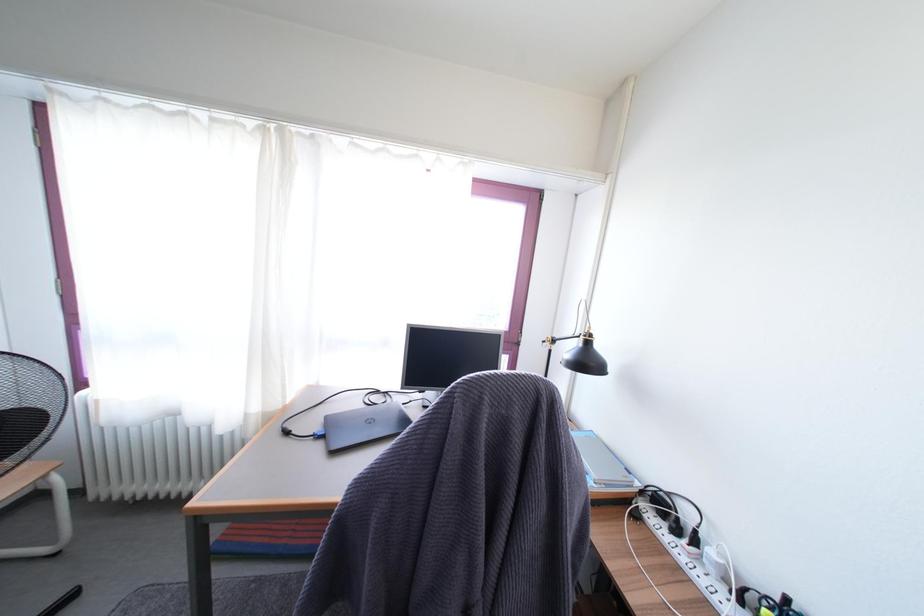
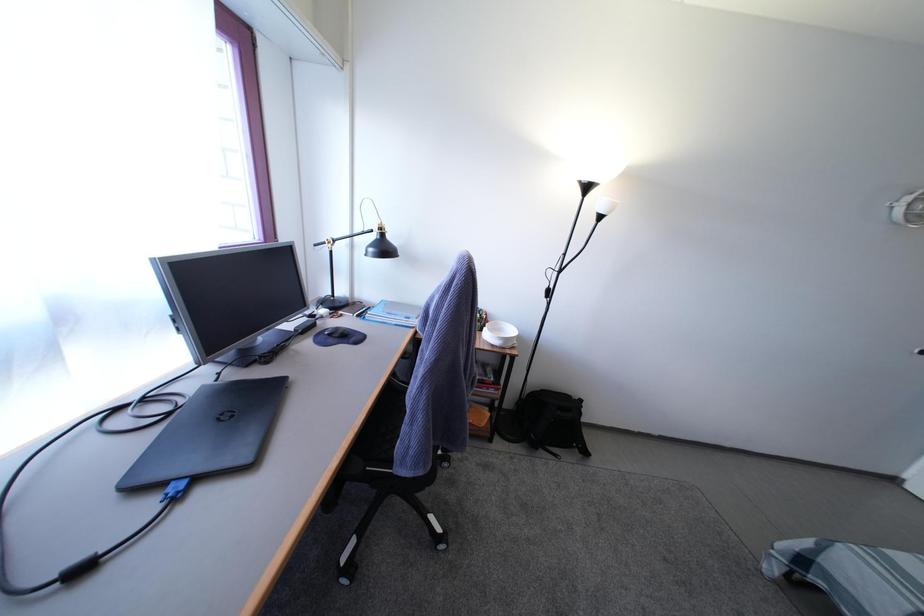
The images are taken continuously from a first-person perspective. In which direction is your viewpoint rotating?

The rotation direction of the camera is right-down.